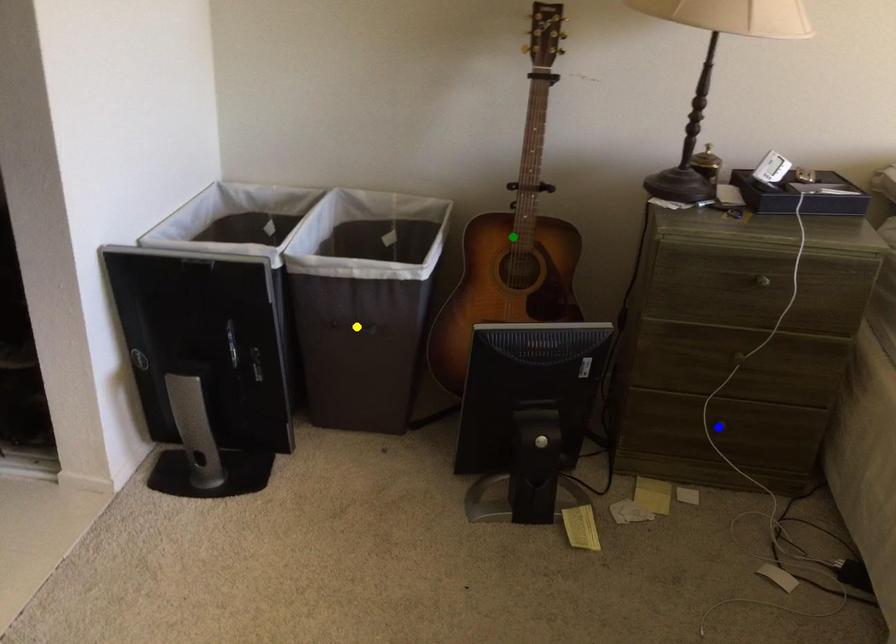
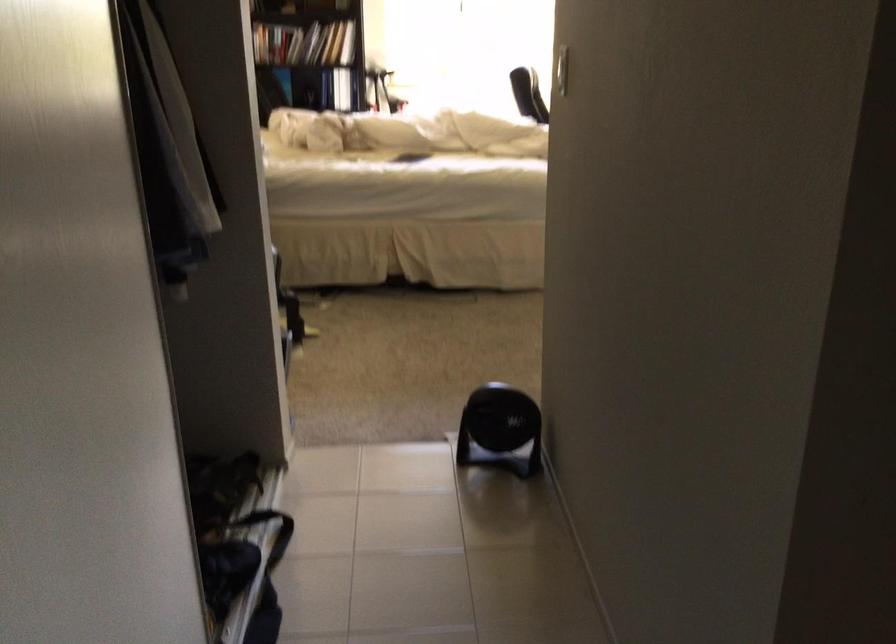
I am providing you with two images of the same scene from different viewpoints. Three points are marked in image1. Which point corresponds to a part or object that is occluded in image2?In image1, three points are marked. Which of them correspond to a part or object that is occluded in image2?Among the three points shown in image1, which one corresponds to a part or object that is no longer visible due to occlusion in image2?

yellow point, green point, blue point cannot be seen in image2.